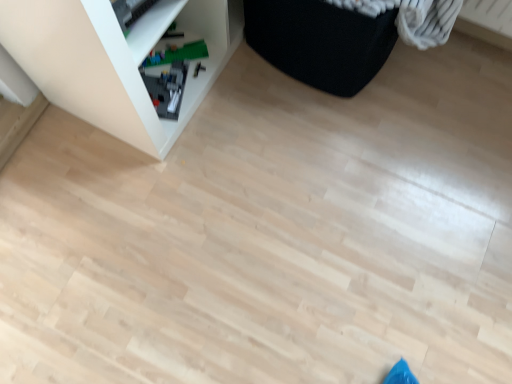
Question: Could you tell me if black fabric ottoman at upper right is turned towards green plastic toy at lower left?

Choices:
 (A) yes
 (B) no

Answer: (B)

Question: From a real-world perspective, is black fabric ottoman at upper right over green plastic toy at lower left?

Choices:
 (A) yes
 (B) no

Answer: (A)

Question: Considering the relative sizes of black fabric ottoman at upper right and green plastic toy at lower left in the image provided, is black fabric ottoman at upper right wider than green plastic toy at lower left?

Choices:
 (A) yes
 (B) no

Answer: (A)

Question: Is black fabric ottoman at upper right surrounding green plastic toy at lower left?

Choices:
 (A) yes
 (B) no

Answer: (B)

Question: Would you consider black fabric ottoman at upper right to be distant from green plastic toy at lower left?

Choices:
 (A) yes
 (B) no

Answer: (B)

Question: Would you say green plastic toy at lower left is to the left or to the right of white plastic shelf at upper left in the picture?

Choices:
 (A) left
 (B) right

Answer: (B)

Question: Considering the positions of point (201, 44) and point (56, 6), is point (201, 44) closer or farther from the camera than point (56, 6)?

Choices:
 (A) closer
 (B) farther

Answer: (B)

Question: From the image's perspective, is green plastic toy at lower left located above or below white plastic shelf at upper left?

Choices:
 (A) below
 (B) above

Answer: (A)

Question: From their relative heights in the image, would you say green plastic toy at lower left is taller or shorter than white plastic shelf at upper left?

Choices:
 (A) tall
 (B) short

Answer: (B)

Question: In terms of size, does white plastic shelf at upper left appear bigger or smaller than black fabric ottoman at upper right?

Choices:
 (A) small
 (B) big

Answer: (B)

Question: From the image's perspective, is white plastic shelf at upper left positioned above or below black fabric ottoman at upper right?

Choices:
 (A) above
 (B) below

Answer: (B)

Question: Based on their positions, is white plastic shelf at upper left located to the left or right of black fabric ottoman at upper right?

Choices:
 (A) right
 (B) left

Answer: (B)

Question: Looking at their shapes, would you say white plastic shelf at upper left is wider or thinner than black fabric ottoman at upper right?

Choices:
 (A) thin
 (B) wide

Answer: (A)

Question: Considering their positions, is green plastic toy at lower left located in front of or behind black fabric ottoman at upper right?

Choices:
 (A) behind
 (B) front

Answer: (A)

Question: Is green plastic toy at lower left to the left or to the right of black fabric ottoman at upper right in the image?

Choices:
 (A) left
 (B) right

Answer: (A)